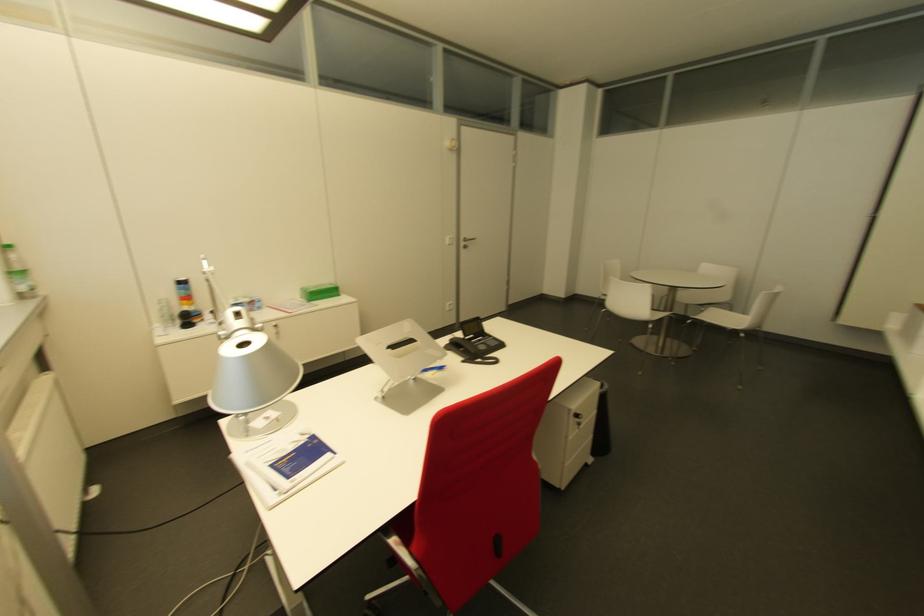
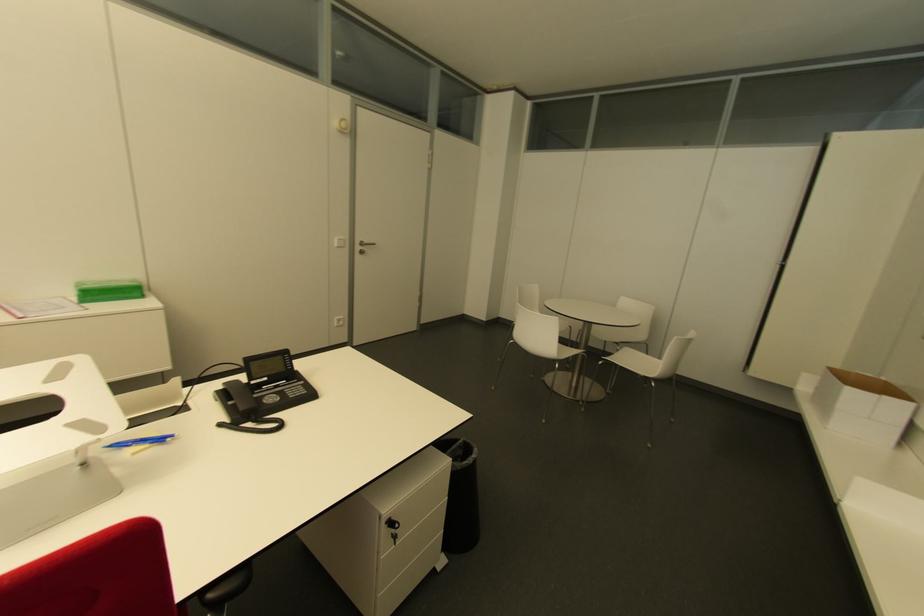
Locate, in the second image, the point that corresponds to point 439,369 in the first image.

(159, 440)